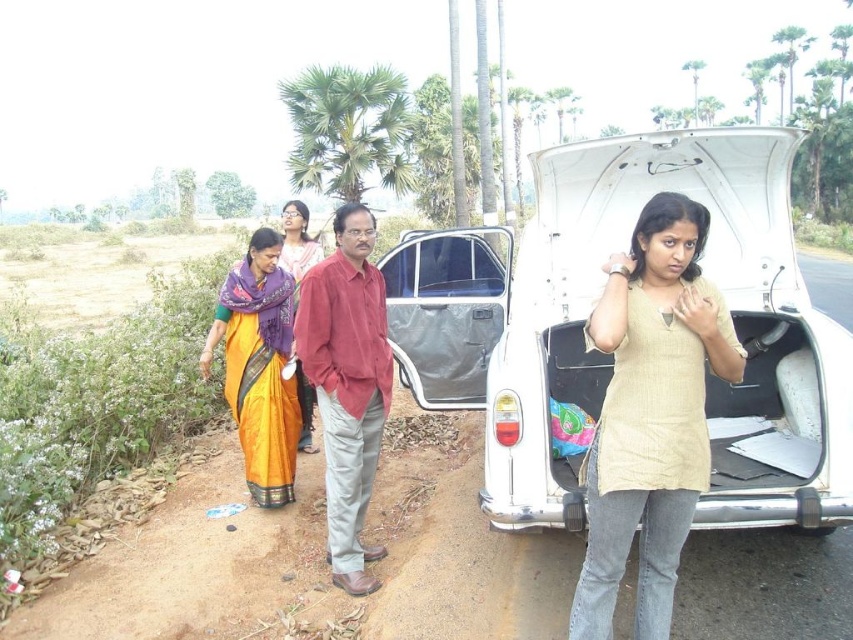
You are trying to determine if the red cotton shirt at center can be placed inside the metallic gray minivan at center. Based on their widths, will it fit?

The red cotton shirt at center has a lesser width compared to metallic gray minivan at center, so it will fit inside.

You are a delivery person who needs to place a package in the trunk of the white matte car trunk at center. The delivery truck is parked at point 0.5 on the x and y axis. Can you reach the trunk without moving the truck?

The white matte car trunk at center is located at point (706, 378), which is slightly offset from the truck parked at (426, 320). Therefore, the delivery person can reach the trunk without needing to move the truck since the coordinates are close enough for access.

You are organizing a fashion show and need to display the orange silk saree at left and the matte purple scarf at center. Which item requires a wider display stand to accommodate its size?

The orange silk saree at left requires a wider display stand because its width is larger than the matte purple scarf at center.